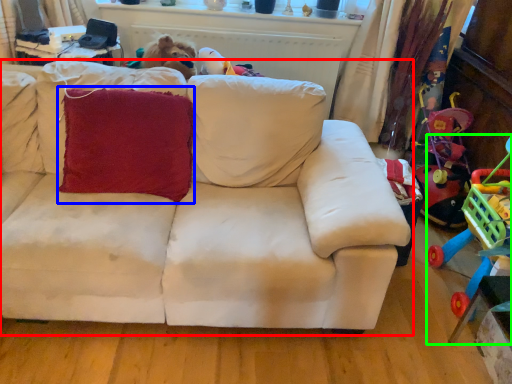
Question: Estimate the real-world distances between objects in this image. Which object is farther from studio couch (highlighted by a red box), throw pillow (highlighted by a blue box) or toy (highlighted by a green box)?

Choices:
 (A) throw pillow
 (B) toy

Answer: (B)